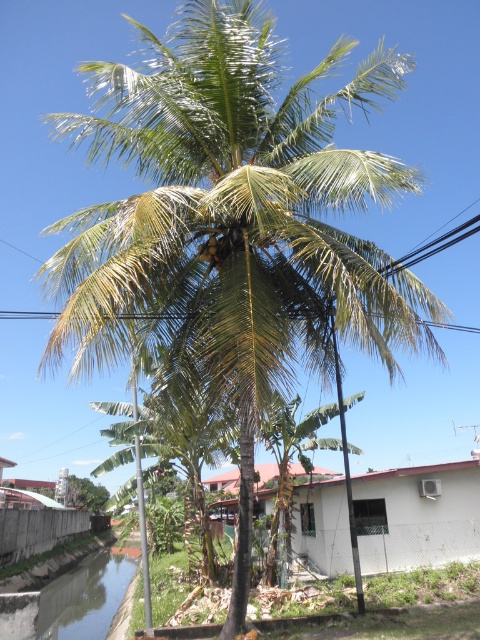
You are standing in the foreground of the image and want to take a photo of both the white matte hut at lower center and the green leafy palm tree at center. Can you fit both in your camera frame if the palm tree is closer to you than the hut?

The white matte hut at lower center might be wider than the green leafy palm tree at center, so if the palm tree is closer to you, it could appear larger in the frame. This might make it challenging to fit both in the camera frame depending on their actual sizes and distances.

You are standing at the origin point of the coordinate system in the image. You want to walk towards the white matte hut at lower center. In which direction should you move relative to your current position?

You should move towards the point at coordinates 0.806 in the x direction and 0.869 in the y direction to reach the white matte hut at lower center.

You are standing in front of the coconut palm tree and want to reach both the point at coordinates point (x=300, y=484) and point (x=204, y=244). Which point should you walk towards first to reach the closer one?

You should walk towards point (x=204, y=244) first because it is closer to you than point (x=300, y=484), which is further away.